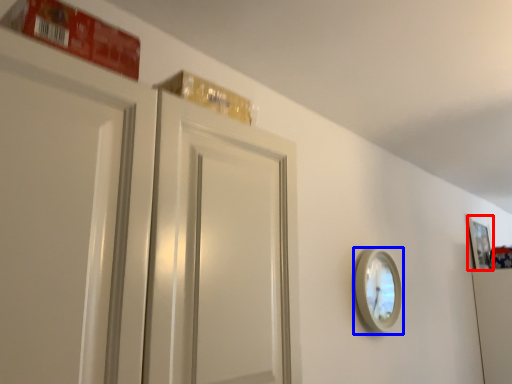
Question: Which point is further to the camera, picture frame (highlighted by a red box) or mirror (highlighted by a blue box)?

Choices:
 (A) picture frame
 (B) mirror

Answer: (A)